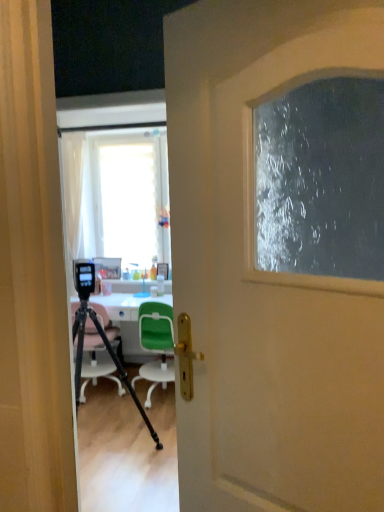
Question: Is white glossy desk at center closer to camera compared to pink plastic chair at center, positioned as the 1th chair in left-to-right order?

Choices:
 (A) yes
 (B) no

Answer: (B)

Question: From the image's perspective, is white glossy desk at center over pink plastic chair at center, the second chair from the right?

Choices:
 (A) no
 (B) yes

Answer: (A)

Question: Considering the relative positions of white glossy desk at center and pink plastic chair at center, the second chair from the right, in the image provided, is white glossy desk at center to the right of pink plastic chair at center, the second chair from the right, from the viewer's perspective?

Choices:
 (A) no
 (B) yes

Answer: (B)

Question: Is white glossy desk at center not within pink plastic chair at center, the second chair from the right?

Choices:
 (A) yes
 (B) no

Answer: (A)

Question: Does white glossy desk at center appear on the left side of pink plastic chair at center, the second chair from the right?

Choices:
 (A) no
 (B) yes

Answer: (A)

Question: From the image's perspective, is white glossy desk at center below pink plastic chair at center, positioned as the 1th chair in left-to-right order?

Choices:
 (A) no
 (B) yes

Answer: (B)

Question: Does pink plastic chair at center, positioned as the 1th chair in left-to-right order, have a smaller size compared to white matte door at center?

Choices:
 (A) no
 (B) yes

Answer: (A)

Question: Is pink plastic chair at center, positioned as the 1th chair in left-to-right order, further to camera compared to white matte door at center?

Choices:
 (A) no
 (B) yes

Answer: (B)

Question: Is pink plastic chair at center, the second chair from the right, in front of white matte door at center?

Choices:
 (A) no
 (B) yes

Answer: (A)

Question: Is pink plastic chair at center, the second chair from the right, bigger than white matte door at center?

Choices:
 (A) yes
 (B) no

Answer: (A)

Question: From the image's perspective, is pink plastic chair at center, positioned as the 1th chair in left-to-right order, located above white matte door at center?

Choices:
 (A) yes
 (B) no

Answer: (B)

Question: Is pink plastic chair at center, the second chair from the right, oriented away from white matte door at center?

Choices:
 (A) no
 (B) yes

Answer: (A)

Question: Is there a large distance between translucent plastic bottle at center and black matte tripod at center?

Choices:
 (A) no
 (B) yes

Answer: (B)